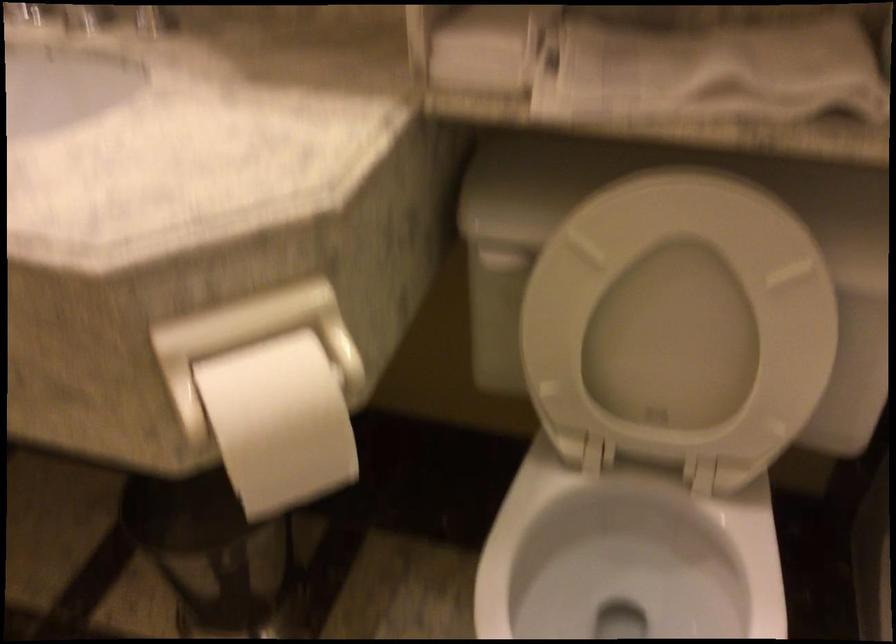
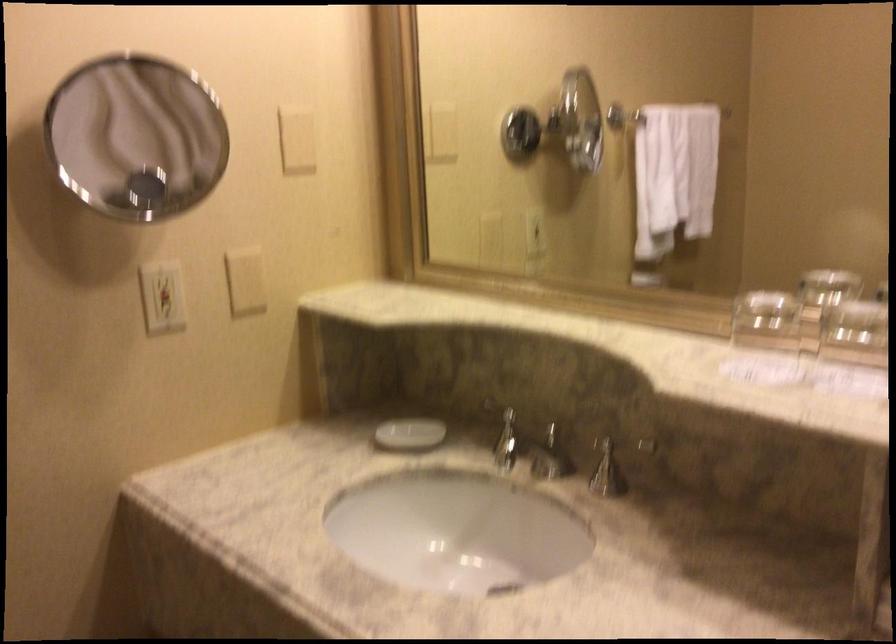
The images are taken continuously from a first-person perspective. In which direction is your viewpoint rotating?

The camera's rotation is toward left-up.